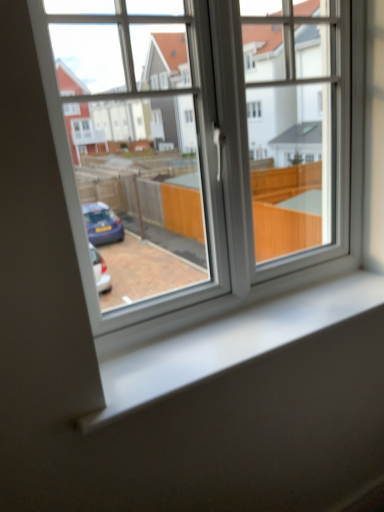
Question: From a real-world perspective, is white glossy window sill at center above or below white plastic window at center?

Choices:
 (A) below
 (B) above

Answer: (A)

Question: Is white glossy window sill at center inside or outside of white plastic window at center?

Choices:
 (A) outside
 (B) inside

Answer: (A)

Question: Is white glossy window sill at center taller or shorter than white plastic window at center?

Choices:
 (A) tall
 (B) short

Answer: (B)

Question: From a real-world perspective, is white plastic window at center physically located above or below white glossy window sill at center?

Choices:
 (A) below
 (B) above

Answer: (B)

Question: Considering the positions of white plastic window at center and white glossy window sill at center in the image, is white plastic window at center bigger or smaller than white glossy window sill at center?

Choices:
 (A) big
 (B) small

Answer: (A)

Question: In terms of width, does white plastic window at center look wider or thinner when compared to white glossy window sill at center?

Choices:
 (A) thin
 (B) wide

Answer: (A)

Question: From their relative heights in the image, would you say white plastic window at center is taller or shorter than white glossy window sill at center?

Choices:
 (A) tall
 (B) short

Answer: (A)